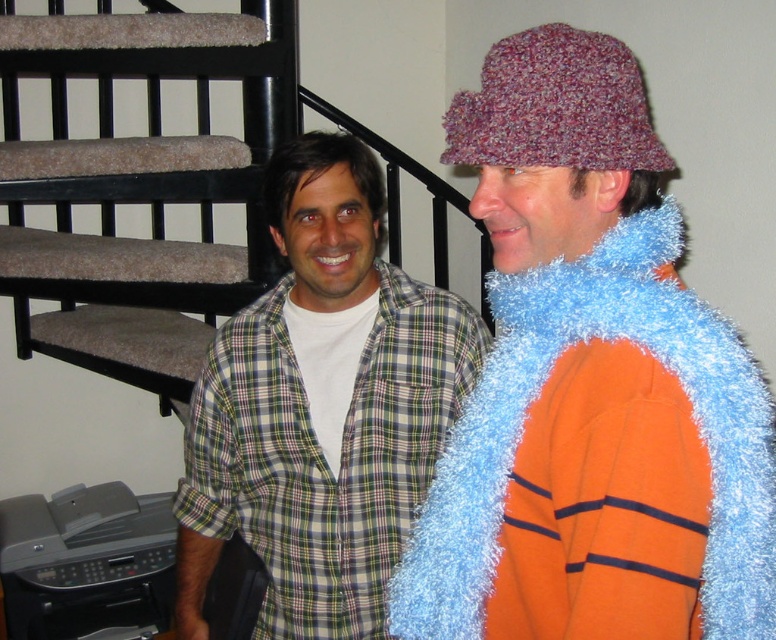
Does fluffy blue scarf at right have a larger size compared to plaid shirt at center?

No, fluffy blue scarf at right is not bigger than plaid shirt at center.

Between point (542, 289) and point (371, 276), which one is positioned behind?

Positioned behind is point (371, 276).

Does point (594, 42) lie behind point (272, 609)?

No, (594, 42) is in front of (272, 609).

Where is `fluffy blue scarf at right`? The height and width of the screenshot is (640, 776). fluffy blue scarf at right is located at coordinates (591, 385).

Does plaid shirt at center appear under black metal balustrade at left?

Indeed, plaid shirt at center is positioned under black metal balustrade at left.

This screenshot has height=640, width=776. Describe the element at coordinates (321, 406) in the screenshot. I see `plaid shirt at center` at that location.

This screenshot has height=640, width=776. I want to click on plaid shirt at center, so click(x=321, y=406).

Who is positioned more to the right, plaid shirt at center or multicolored knitted hat at upper right?

From the viewer's perspective, multicolored knitted hat at upper right appears more on the right side.

Does plaid shirt at center appear over multicolored knitted hat at upper right?

No.

Does point (365, 512) lie in front of point (513, 77)?

That is False.

I want to click on plaid shirt at center, so coord(321,406).